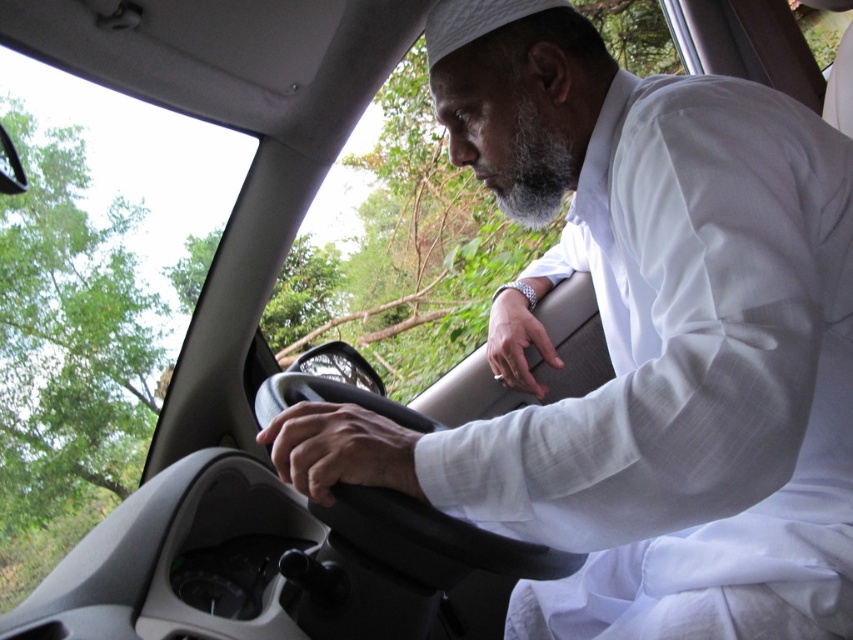
You are a passenger in the car and notice two items at the center of your view. Which item is closer to you, the white silk robe at center or the smooth skin hand at center?

The white silk robe at center is positioned over the smooth skin hand at center, so the white silk robe at center is closer to you.

You are a passenger in the car and want to hand the driver a map. The map is currently on the silver metallic wristwatch at center. To reach it, should you move your hand to the left or right of the white silk robe at center?

The white silk robe at center is to the right of the silver metallic wristwatch at center. Therefore, to reach the map on the silver metallic wristwatch at center, you should move your hand to the left of the white silk robe at center.

You are a passenger in the car and want to hand the driver a document. The driver is wearing a white silk robe at center and a silver metallic wristwatch at center. Which item is closer to the driver s hands?

The white silk robe at center is below the silver metallic wristwatch at center, so the silver metallic wristwatch at center is closer to the driver s hands.